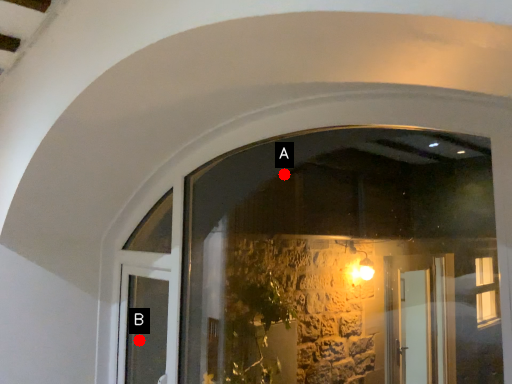
Question: Two points are circled on the image, labeled by A and B beside each circle. Which point appears closest to the camera in this image?

Choices:
 (A) A is closer
 (B) B is closer

Answer: (B)